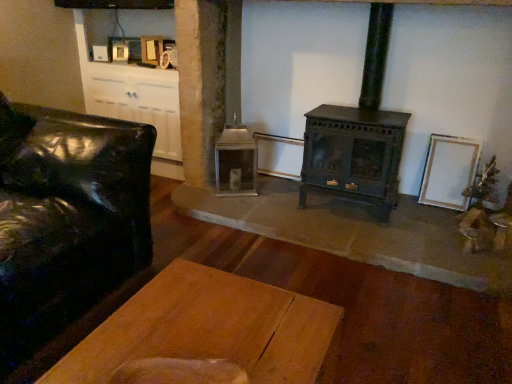
Image resolution: width=512 pixels, height=384 pixels. What are the coordinates of `free spot in front of green matte wood burning stove at center` in the screenshot? It's located at (346, 233).